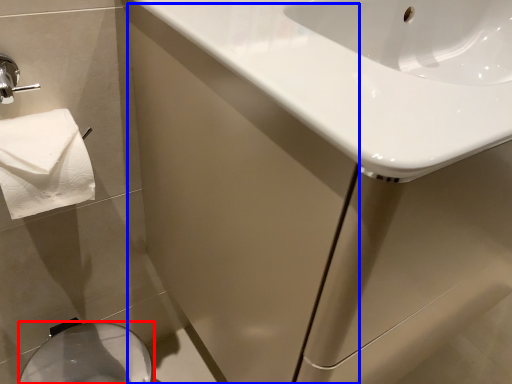
Question: Which object appears closest to the camera in this image, bidet (highlighted by a red box) or screen door (highlighted by a blue box)?

Choices:
 (A) bidet
 (B) screen door

Answer: (B)